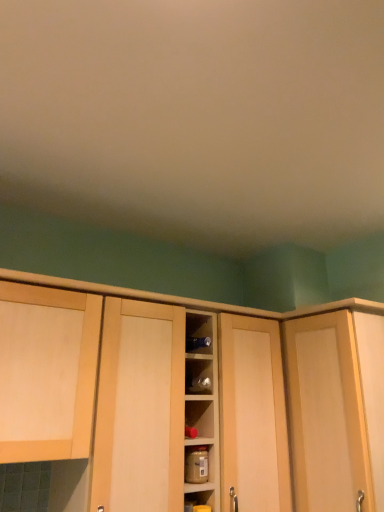
Question: Looking at the image, does brown matte jar at center seem bigger or smaller compared to light wood cabinet door at right?

Choices:
 (A) small
 (B) big

Answer: (A)

Question: Considering the positions of point (200, 487) and point (294, 479), is point (200, 487) closer or farther from the camera than point (294, 479)?

Choices:
 (A) closer
 (B) farther

Answer: (A)

Question: Estimate the real-world distances between objects in this image. Which object is farther from the light wood cabinet door at right?

Choices:
 (A) light wood cabinet at left, acting as the first cabinetry starting from the left
 (B) brown matte jar at center
 (C) wooden cabinet at center, marked as the 1th cabinetry in a right-to-left arrangement

Answer: (A)

Question: Which object is the farthest from the light wood cabinet door at right?

Choices:
 (A) wooden cabinet at center, marked as the 1th cabinetry in a right-to-left arrangement
 (B) brown matte jar at center
 (C) light wood cabinet at left, the 2th cabinetry positioned from the right

Answer: (C)